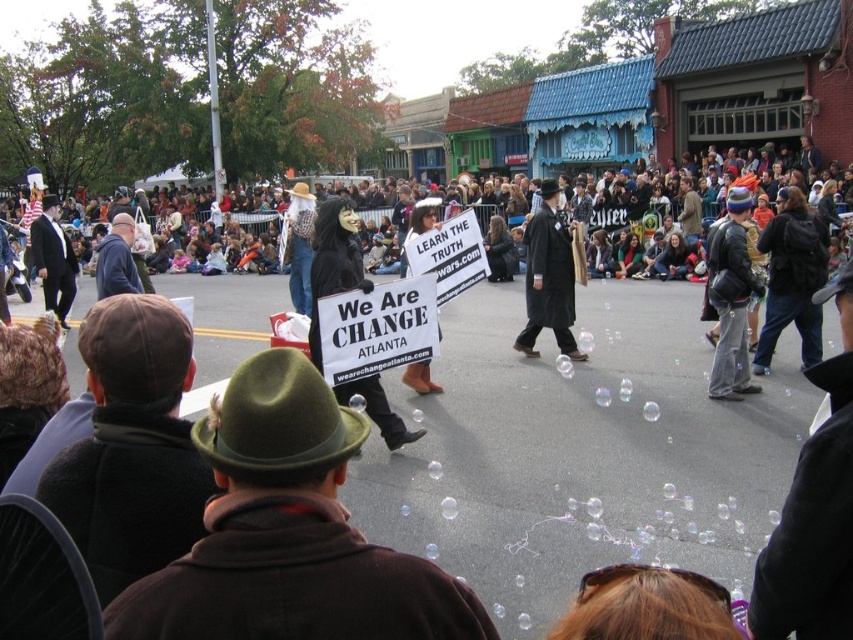
Can you confirm if black wool coat at center is taller than white paper sign at center?

In fact, black wool coat at center may be shorter than white paper sign at center.

Does black wool coat at center appear on the left side of white paper sign at center?

No, black wool coat at center is not to the left of white paper sign at center.

Is point (527, 352) farther from viewer compared to point (424, 212)?

Yes, it is.

This screenshot has width=853, height=640. I want to click on black wool coat at center, so click(548, 276).

Measure the distance between point (521,195) and camera.

Point (521,195) is 30.17 meters away from camera.

Does dark brown leather jacket at upper center appear under white paper sign at center?

No, dark brown leather jacket at upper center is not below white paper sign at center.

Is point (245, 221) farther from viewer compared to point (428, 220)?

Yes, it is behind point (428, 220).

The height and width of the screenshot is (640, 853). I want to click on dark brown leather jacket at upper center, so click(x=637, y=209).

Can you confirm if black matte mask at center is wider than black wool coat at center?

Indeed, black matte mask at center has a greater width compared to black wool coat at center.

Does black matte mask at center have a lesser width compared to black wool coat at center?

Incorrect, black matte mask at center's width is not less than black wool coat at center's.

Is point (331, 278) positioned before point (581, 356)?

Yes, point (331, 278) is in front of point (581, 356).

Find the location of a particular element. black matte mask at center is located at coordinates (334, 260).